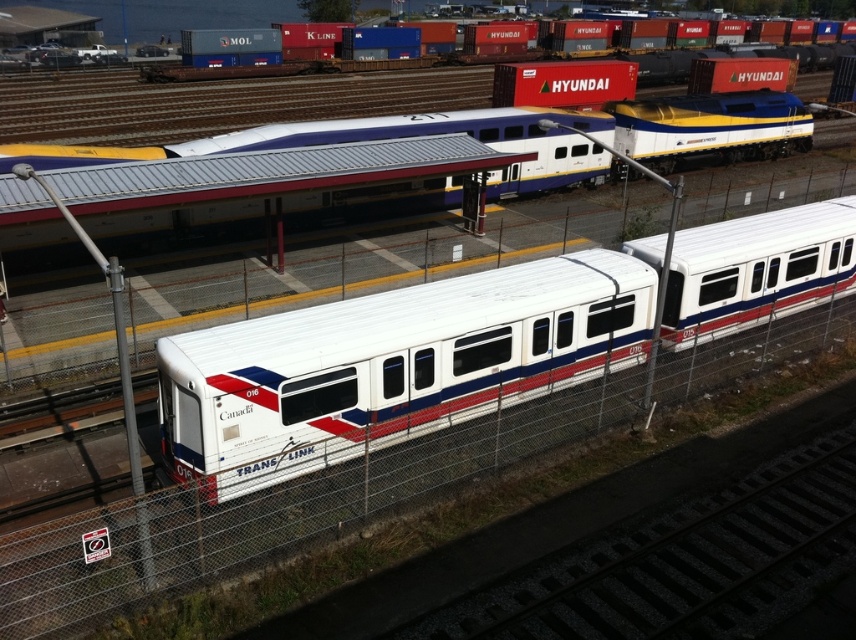
Does white glossy train at center have a lesser width compared to matte white train at upper center?

Indeed, white glossy train at center has a lesser width compared to matte white train at upper center.

Can you confirm if white glossy train at center is wider than matte white train at upper center?

No.

You are a GUI agent. You are given a task and a screenshot of the screen. Output one action in this format:
    pyautogui.click(x=<x>, y=<y>)
    Task: Click on the white glossy train at center
    Image resolution: width=856 pixels, height=640 pixels.
    Given the screenshot: What is the action you would take?
    pyautogui.click(x=373, y=168)

This screenshot has height=640, width=856. What are the coordinates of `white glossy train at center` in the screenshot? It's located at (373, 168).

Is white glossy passenger train at center below matte white train at upper center?

Yes, white glossy passenger train at center is below matte white train at upper center.

Measure the distance between white glossy passenger train at center and matte white train at upper center.

white glossy passenger train at center is 74.68 meters from matte white train at upper center.

Where is `white glossy passenger train at center`? This screenshot has width=856, height=640. white glossy passenger train at center is located at coordinates (395, 364).

Find the location of `white glossy passenger train at center`. white glossy passenger train at center is located at coordinates (395, 364).

Where is `white glossy passenger train at center`? This screenshot has width=856, height=640. white glossy passenger train at center is located at coordinates (395, 364).